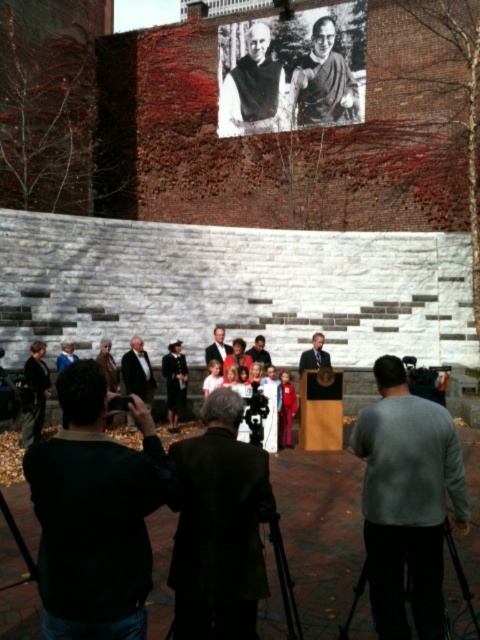
Question: Is black matte tripod at lower right to the right of smooth gray suit at center from the viewer's perspective?

Choices:
 (A) yes
 (B) no

Answer: (A)

Question: Is smooth gray suit at center bigger than dark gray suit at center?

Choices:
 (A) no
 (B) yes

Answer: (B)

Question: Does dark brown suit at center come in front of black matte tripod at center?

Choices:
 (A) no
 (B) yes

Answer: (A)

Question: Which point appears closest to the camera in this image?

Choices:
 (A) (420, 524)
 (B) (250, 348)
 (C) (148, 387)

Answer: (A)

Question: Based on their relative distances, which object is farther from the black matte tripod at center?

Choices:
 (A) black matte tripod at lower right
 (B) dark gray robe at upper center

Answer: (B)

Question: Which object is farther from the camera taking this photo?

Choices:
 (A) black matte tripod at lower right
 (B) matte black podium at center
 (C) black and white photograph of man at upper center
 (D) dark brown suit at center

Answer: (C)